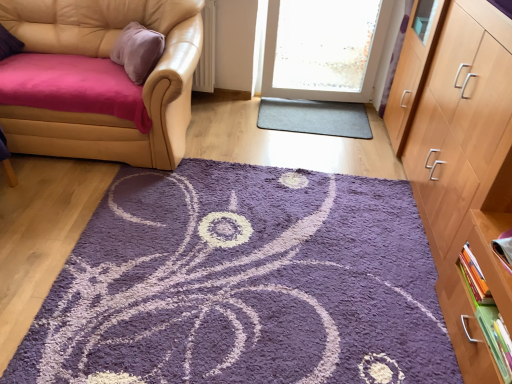
Question: From the image's perspective, is gray rubber mat at center below light brown wood cabinet at right?

Choices:
 (A) yes
 (B) no

Answer: (B)

Question: Is gray rubber mat at center facing away from light brown wood cabinet at right?

Choices:
 (A) yes
 (B) no

Answer: (B)

Question: Is gray rubber mat at center aimed at light brown wood cabinet at right?

Choices:
 (A) yes
 (B) no

Answer: (B)

Question: From a real-world perspective, is gray rubber mat at center on top of light brown wood cabinet at right?

Choices:
 (A) yes
 (B) no

Answer: (B)

Question: Is light brown wood cabinet at right located within gray rubber mat at center?

Choices:
 (A) yes
 (B) no

Answer: (B)

Question: Is gray rubber mat at center wider or thinner than light brown wood cabinet at right?

Choices:
 (A) wide
 (B) thin

Answer: (B)

Question: Considering the relative positions of gray rubber mat at center and light brown wood cabinet at right in the image provided, is gray rubber mat at center to the left or to the right of light brown wood cabinet at right?

Choices:
 (A) right
 (B) left

Answer: (B)

Question: Considering the positions of gray rubber mat at center and light brown wood cabinet at right in the image, is gray rubber mat at center taller or shorter than light brown wood cabinet at right?

Choices:
 (A) tall
 (B) short

Answer: (B)

Question: In the image, is gray rubber mat at center positioned in front of or behind light brown wood cabinet at right?

Choices:
 (A) front
 (B) behind

Answer: (B)

Question: Is matte purple book at right, positioned as the 3th book in bottom-to-top order, to the left or to the right of green matte book at lower right, which is counted as the first book, starting from the bottom, in the image?

Choices:
 (A) left
 (B) right

Answer: (B)

Question: Is matte purple book at right, positioned as the 3th book in bottom-to-top order, wider or thinner than green matte book at lower right, which ranks as the 3th book in top-to-bottom order?

Choices:
 (A) wide
 (B) thin

Answer: (A)

Question: Is point (509, 243) positioned closer to the camera than point (497, 339)?

Choices:
 (A) closer
 (B) farther

Answer: (B)

Question: Considering the positions of matte purple book at right, positioned as the 3th book in bottom-to-top order, and green matte book at lower right, which ranks as the 3th book in top-to-bottom order, in the image, is matte purple book at right, positioned as the 3th book in bottom-to-top order, bigger or smaller than green matte book at lower right, which ranks as the 3th book in top-to-bottom order,?

Choices:
 (A) small
 (B) big

Answer: (B)

Question: Is point [483, 283] positioned closer to the camera than point [26, 148]?

Choices:
 (A) farther
 (B) closer

Answer: (B)

Question: In the image, is hardcover book at right, the 2th book positioned from the top, positioned in front of or behind leather couch at left?

Choices:
 (A) front
 (B) behind

Answer: (A)